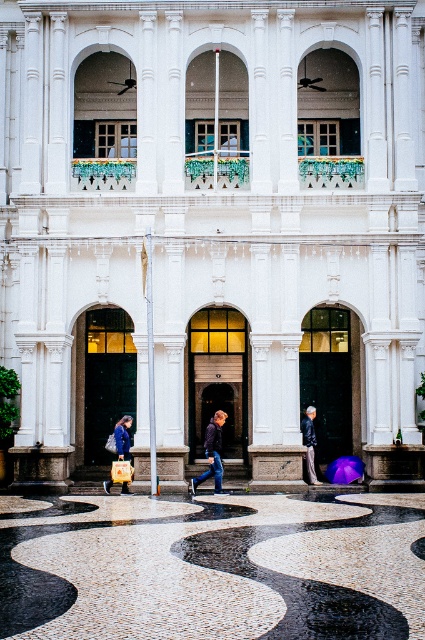
You are a delivery person carrying a package that requires a dry path to avoid damage. The package is 2 meters long and needs to be kept horizontal. The transparent purple umbrella at center and the blue denim jacket at lower left are in the way. Can you move the package horizontally between them without touching either object?

The distance between the transparent purple umbrella at center and the blue denim jacket at lower left is 8.96 meters. Since the package is 2 meters long, there is sufficient space to move it horizontally between them without touching either object.

You are standing at the entrance of the building and see two jackets, the denim jacket at center and the blue denim jacket at lower left. Which one is taller?

The blue denim jacket at lower left is taller than the denim jacket at center.

You are standing at the point labeled point (337, 468) and want to walk to the person walking away from the camera towards the left side. The path is along the wet pavement. If your walking speed is 1.2 meters per second, how many seconds will it take you to reach them?

The distance between you and the person is 42.24 meters. At a speed of 1.2 meters per second, it will take you 42.24 divided by 1.2 equals 35.2 seconds to reach them.